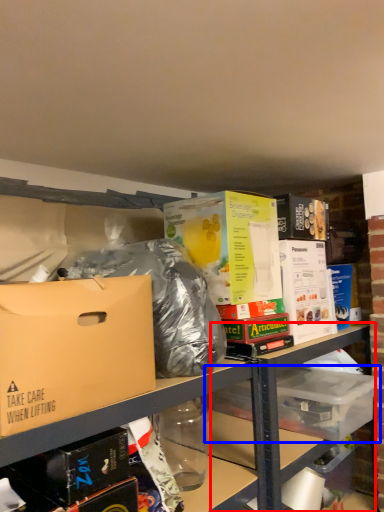
Question: Which point is further to the camera, table (highlighted by a red box) or storage box (highlighted by a blue box)?

Choices:
 (A) table
 (B) storage box

Answer: (B)